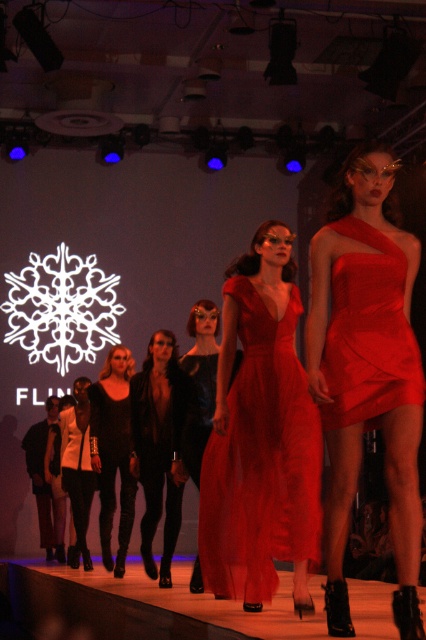
Who is lower down, satin/red dress at center or satin black dress at center?

satin black dress at center is lower down.

Between satin/red dress at center and satin black dress at center, which one has more height?

satin black dress at center

Is point (374, 422) positioned before point (204, 352)?

Yes, point (374, 422) is closer to viewer.

The height and width of the screenshot is (640, 426). I want to click on satin/red dress at center, so [368, 332].

Is satin dress at center below white matte jacket at center?

No.

Who is more distant from viewer, (239, 426) or (86, 520)?

The point (86, 520) is behind.

The height and width of the screenshot is (640, 426). What are the coordinates of `satin dress at center` in the screenshot? It's located at (261, 436).

This screenshot has width=426, height=640. I want to click on satin dress at center, so click(x=261, y=436).

Can you confirm if satin/red dress at center is smaller than black leather jacket at center?

Yes, satin/red dress at center is smaller than black leather jacket at center.

Image resolution: width=426 pixels, height=640 pixels. Find the location of `satin/red dress at center`. satin/red dress at center is located at coordinates (368, 332).

Does point (409, 339) come closer to viewer compared to point (149, 483)?

Yes, point (409, 339) is closer to viewer.

Locate an element on the screen. This screenshot has height=640, width=426. satin/red dress at center is located at coordinates (368, 332).